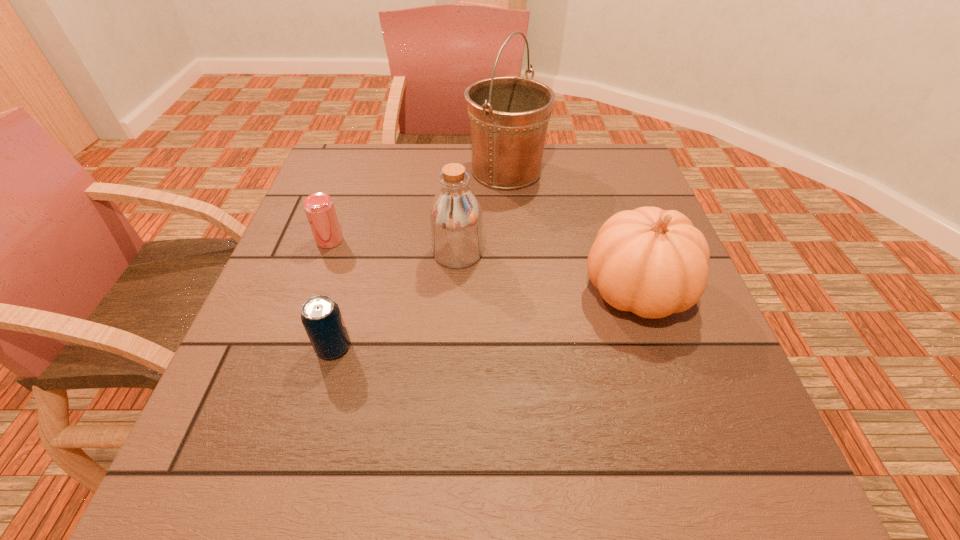
The width and height of the screenshot is (960, 540). Find the location of `bucket`. bucket is located at coordinates (509, 116).

Locate an element on the screen. the farthest object is located at coordinates (509, 116).

The height and width of the screenshot is (540, 960). Find the location of `bottle`. bottle is located at coordinates (456, 222).

In order to click on pumpkin in this screenshot , I will do `click(653, 262)`.

Where is `soda can`? The height and width of the screenshot is (540, 960). soda can is located at coordinates (321, 317).

You are a GUI agent. You are given a task and a screenshot of the screen. Output one action in this format:
    pyautogui.click(x=<x>, y=<y>)
    Task: Click on the leftmost object
    
    Given the screenshot: What is the action you would take?
    point(319,208)

Where is `vacant space situated 0.190m on the left of the bucket`? vacant space situated 0.190m on the left of the bucket is located at coordinates (398, 171).

Where is `vacant space located on the left of the bottle`? This screenshot has height=540, width=960. vacant space located on the left of the bottle is located at coordinates (309, 253).

Where is `vacant space located 0.120m on the left of the rightmost object`? vacant space located 0.120m on the left of the rightmost object is located at coordinates (525, 290).

Locate an element on the screen. This screenshot has width=960, height=540. vacant space located on the back of the soda can is located at coordinates (353, 277).